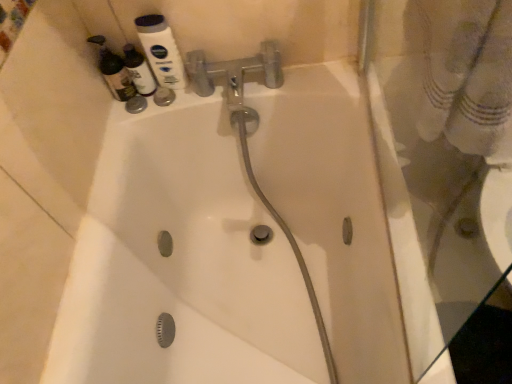
Question: Is matte white bottle at upper left, the second cleaning product when ordered from right to left, thinner than matte white bottle at upper left, which appears as the first cleaning product when viewed from the right?

Choices:
 (A) no
 (B) yes

Answer: (A)

Question: Considering the relative sizes of matte white bottle at upper left, the second cleaning product when ordered from right to left, and matte white bottle at upper left, which appears as the first cleaning product when viewed from the right, in the image provided, is matte white bottle at upper left, the second cleaning product when ordered from right to left, smaller than matte white bottle at upper left, which appears as the first cleaning product when viewed from the right,?

Choices:
 (A) no
 (B) yes

Answer: (A)

Question: Does matte white bottle at upper left, the second cleaning product when ordered from right to left, have a lesser height compared to matte white bottle at upper left, arranged as the second cleaning product when viewed from the left?

Choices:
 (A) no
 (B) yes

Answer: (A)

Question: Can you confirm if matte white bottle at upper left, placed as the 1th cleaning product when sorted from left to right, is bigger than matte white bottle at upper left, arranged as the second cleaning product when viewed from the left?

Choices:
 (A) yes
 (B) no

Answer: (A)

Question: Could you tell me if matte white bottle at upper left, placed as the 1th cleaning product when sorted from left to right, is turned towards matte white bottle at upper left, which appears as the first cleaning product when viewed from the right?

Choices:
 (A) no
 (B) yes

Answer: (A)

Question: Is matte white bottle at upper left, arranged as the second cleaning product when viewed from the left, in front of or behind matte white bottle at upper left, the second cleaning product when ordered from right to left, in the image?

Choices:
 (A) behind
 (B) front

Answer: (A)

Question: From the image's perspective, is matte white bottle at upper left, arranged as the second cleaning product when viewed from the left, located above or below matte white bottle at upper left, placed as the 1th cleaning product when sorted from left to right?

Choices:
 (A) above
 (B) below

Answer: (B)

Question: Considering the positions of point (148, 82) and point (96, 43), is point (148, 82) closer or farther from the camera than point (96, 43)?

Choices:
 (A) closer
 (B) farther

Answer: (B)

Question: In terms of width, does matte white bottle at upper left, arranged as the second cleaning product when viewed from the left, look wider or thinner when compared to matte white bottle at upper left, the second cleaning product when ordered from right to left?

Choices:
 (A) thin
 (B) wide

Answer: (A)

Question: From the image's perspective, is white glossy mouthwash at upper left located above or below matte white bottle at upper left, arranged as the second cleaning product when viewed from the left?

Choices:
 (A) below
 (B) above

Answer: (B)

Question: Is point (147, 31) closer or farther from the camera than point (146, 79)?

Choices:
 (A) farther
 (B) closer

Answer: (B)

Question: Relative to matte white bottle at upper left, arranged as the second cleaning product when viewed from the left, is white glossy mouthwash at upper left in front or behind?

Choices:
 (A) front
 (B) behind

Answer: (A)

Question: From a real-world perspective, relative to matte white bottle at upper left, arranged as the second cleaning product when viewed from the left, is white glossy mouthwash at upper left vertically above or below?

Choices:
 (A) below
 (B) above

Answer: (B)

Question: In terms of height, does white glossy mouthwash at upper left look taller or shorter compared to matte white bottle at upper left, placed as the 1th cleaning product when sorted from left to right?

Choices:
 (A) short
 (B) tall

Answer: (B)

Question: Is white glossy mouthwash at upper left bigger or smaller than matte white bottle at upper left, placed as the 1th cleaning product when sorted from left to right?

Choices:
 (A) small
 (B) big

Answer: (A)